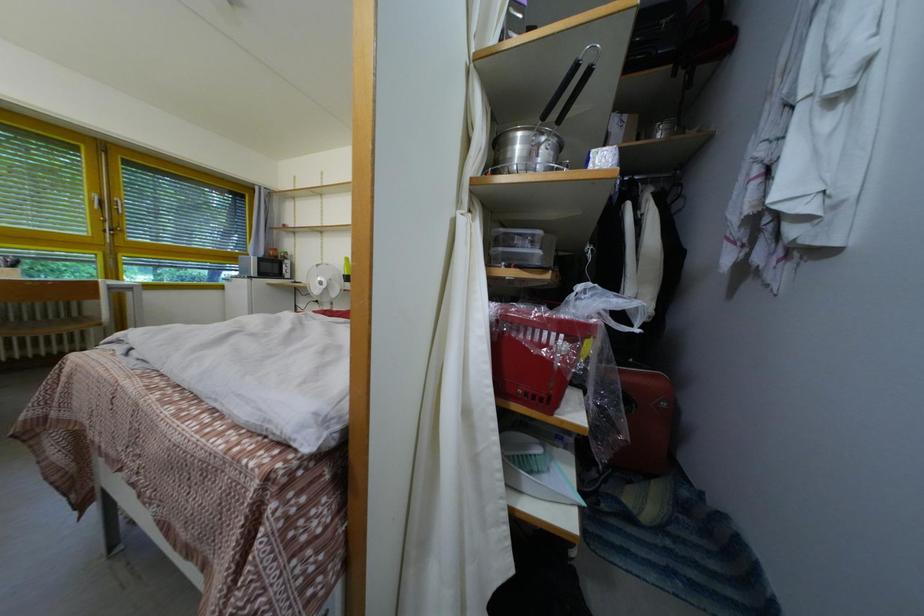
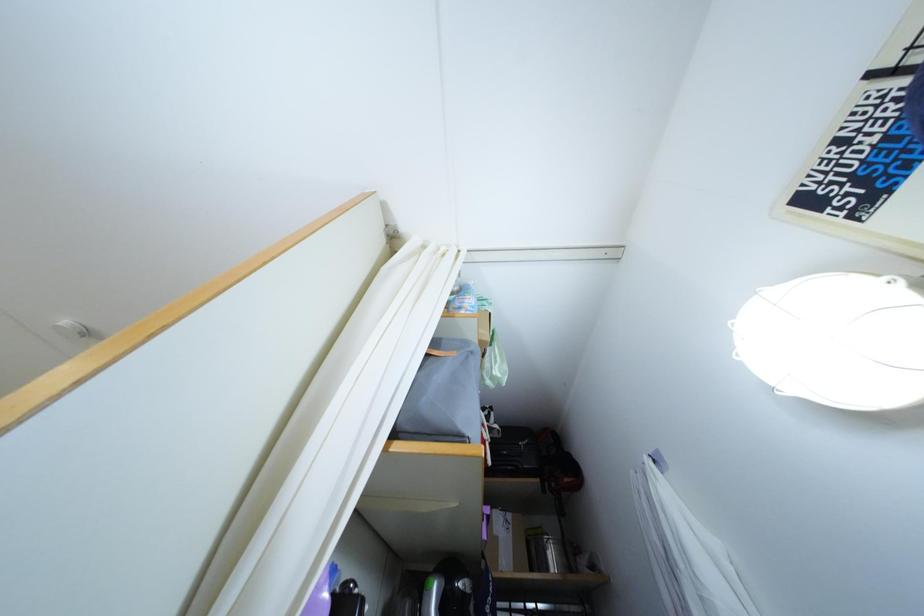
First-person continuous shooting, in which direction is the camera rotating?

The camera's rotation is toward right-up.